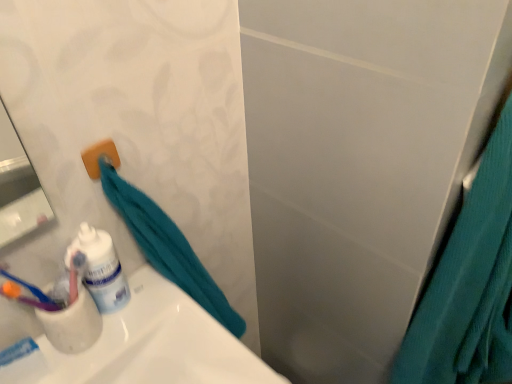
Question: Is white glossy toothpaste tube at lower left shorter than teal fabric shower curtain at right?

Choices:
 (A) yes
 (B) no

Answer: (A)

Question: Is the depth of white glossy toothpaste tube at lower left less than that of teal fabric shower curtain at right?

Choices:
 (A) no
 (B) yes

Answer: (A)

Question: Does white glossy toothpaste tube at lower left touch teal fabric shower curtain at right?

Choices:
 (A) no
 (B) yes

Answer: (A)

Question: From the image's perspective, is white glossy toothpaste tube at lower left on teal fabric shower curtain at right?

Choices:
 (A) yes
 (B) no

Answer: (A)

Question: From the image's perspective, would you say white glossy toothpaste tube at lower left is shown under teal fabric shower curtain at right?

Choices:
 (A) no
 (B) yes

Answer: (A)

Question: Looking at the image, does teal fabric shower curtain at right seem bigger or smaller compared to white glossy toothpaste tube at lower left?

Choices:
 (A) big
 (B) small

Answer: (A)

Question: Considering the positions of teal fabric shower curtain at right and white glossy toothpaste tube at lower left in the image, is teal fabric shower curtain at right wider or thinner than white glossy toothpaste tube at lower left?

Choices:
 (A) thin
 (B) wide

Answer: (B)

Question: Is teal fabric shower curtain at right in front of or behind white glossy toothpaste tube at lower left in the image?

Choices:
 (A) front
 (B) behind

Answer: (A)

Question: In terms of height, does teal fabric shower curtain at right look taller or shorter compared to white glossy toothpaste tube at lower left?

Choices:
 (A) short
 (B) tall

Answer: (B)

Question: From the image's perspective, is teal fabric towel at left located above or below teal fabric shower curtain at right?

Choices:
 (A) above
 (B) below

Answer: (A)

Question: Would you say teal fabric towel at left is to the left or to the right of teal fabric shower curtain at right in the picture?

Choices:
 (A) right
 (B) left

Answer: (B)

Question: From a real-world perspective, is teal fabric towel at left positioned above or below teal fabric shower curtain at right?

Choices:
 (A) above
 (B) below

Answer: (A)

Question: Is point (229, 316) closer or farther from the camera than point (449, 332)?

Choices:
 (A) farther
 (B) closer

Answer: (A)

Question: Would you say teal fabric towel at left is to the left or to the right of white matte toothpaste at lower left in the picture?

Choices:
 (A) right
 (B) left

Answer: (A)

Question: Considering the positions of point (131, 221) and point (27, 352), is point (131, 221) closer or farther from the camera than point (27, 352)?

Choices:
 (A) farther
 (B) closer

Answer: (A)